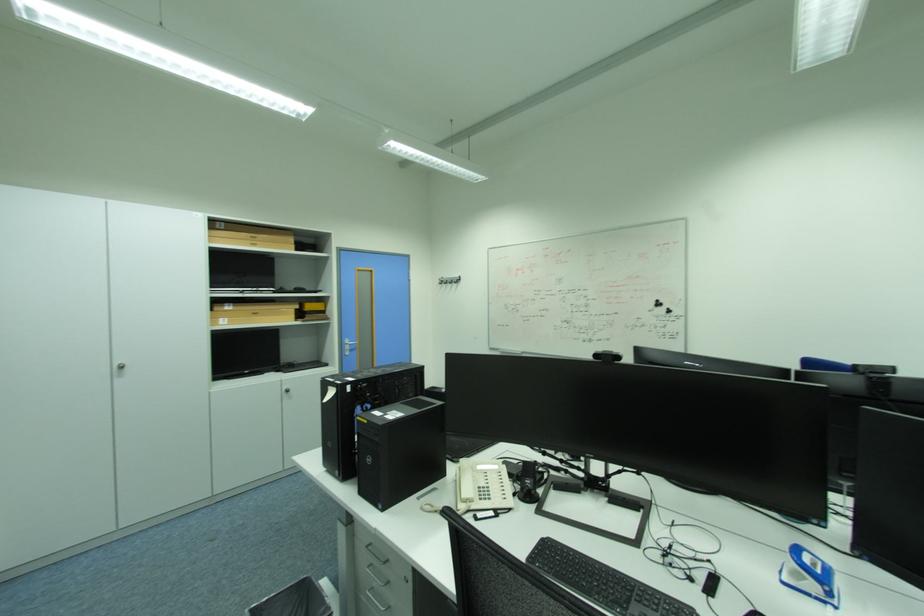
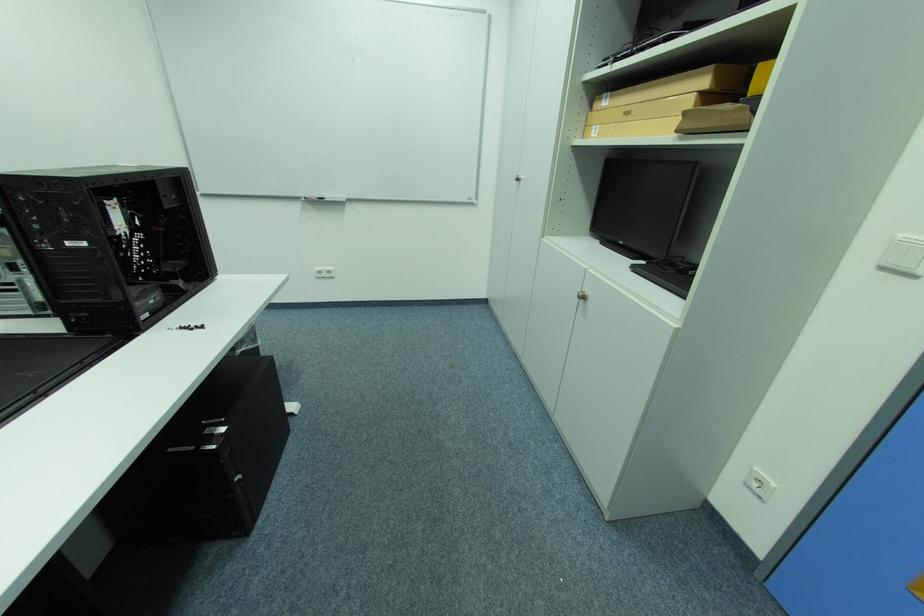
In the second image, find the point that corresponds to [228,320] in the first image.

(602, 128)